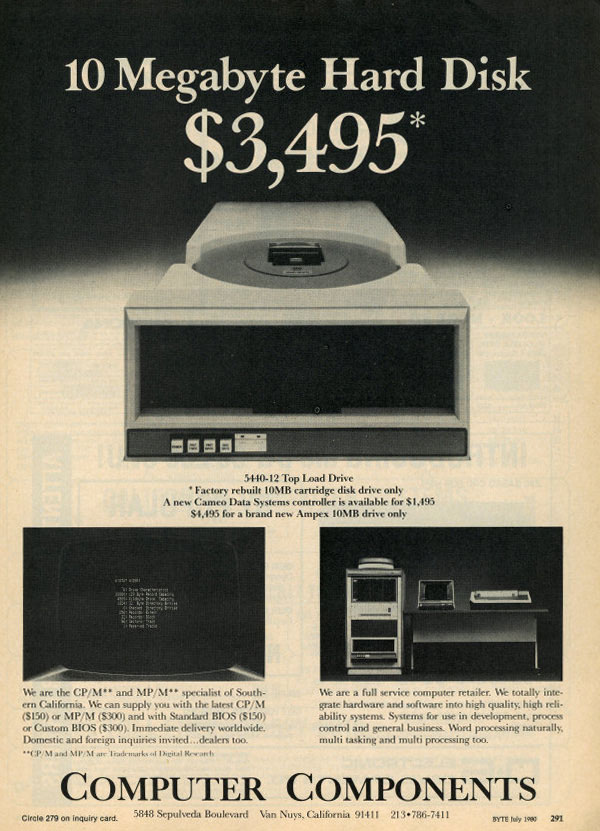
Locate an element on the screen. The width and height of the screenshot is (600, 831). typewriter is located at coordinates (498, 598).